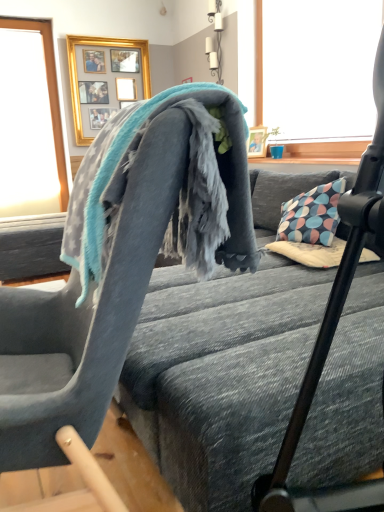
Question: Is gold framed picture at upper center at the right side of transparent glass window at upper left?

Choices:
 (A) yes
 (B) no

Answer: (A)

Question: Is gold framed picture at upper center to the left of transparent glass window at upper left from the viewer's perspective?

Choices:
 (A) yes
 (B) no

Answer: (B)

Question: From a real-world perspective, is gold framed picture at upper center on top of transparent glass window at upper left?

Choices:
 (A) yes
 (B) no

Answer: (A)

Question: From the image's perspective, is gold framed picture at upper center on transparent glass window at upper left?

Choices:
 (A) no
 (B) yes

Answer: (B)

Question: Is gold framed picture at upper center further to the viewer compared to transparent glass window at upper left?

Choices:
 (A) yes
 (B) no

Answer: (A)

Question: Is gold framed picture at upper center shorter than transparent glass window at upper left?

Choices:
 (A) yes
 (B) no

Answer: (A)

Question: Considering the relative sizes of gray fleece blanket at center and soft gray fabric chair at upper center in the image provided, is gray fleece blanket at center wider than soft gray fabric chair at upper center?

Choices:
 (A) yes
 (B) no

Answer: (B)

Question: Is there a large distance between gray fleece blanket at center and soft gray fabric chair at upper center?

Choices:
 (A) no
 (B) yes

Answer: (A)

Question: Considering the relative positions of gray fleece blanket at center and soft gray fabric chair at upper center in the image provided, is gray fleece blanket at center to the right of soft gray fabric chair at upper center from the viewer's perspective?

Choices:
 (A) yes
 (B) no

Answer: (A)

Question: Is gray fleece blanket at center oriented towards soft gray fabric chair at upper center?

Choices:
 (A) no
 (B) yes

Answer: (B)

Question: Is gray fleece blanket at center at the left side of soft gray fabric chair at upper center?

Choices:
 (A) yes
 (B) no

Answer: (B)

Question: Can soft gray fabric chair at upper center be found inside gray fleece blanket at center?

Choices:
 (A) yes
 (B) no

Answer: (B)

Question: Can you confirm if transparent glass window at upper left is positioned to the right of soft gray fabric chair at upper center?

Choices:
 (A) yes
 (B) no

Answer: (B)